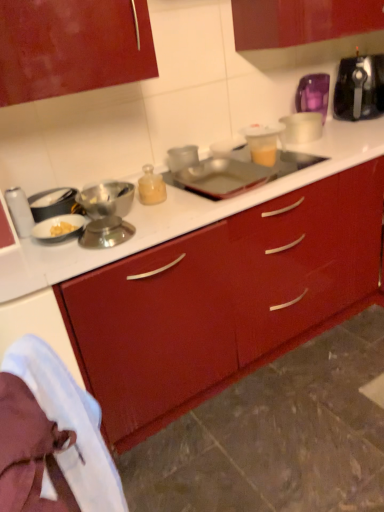
Question: Can you confirm if translucent plastic cup at upper right, the first appliance in the right-to-left sequence, is thinner than metallic silver tray at center, the second appliance from the left?

Choices:
 (A) yes
 (B) no

Answer: (A)

Question: Does translucent plastic cup at upper right, which is counted as the fourth appliance, starting from the left, have a smaller size compared to metallic silver tray at center, which is the 3th appliance from right to left?

Choices:
 (A) yes
 (B) no

Answer: (A)

Question: Is translucent plastic cup at upper right, the first appliance in the right-to-left sequence, closer to the viewer compared to metallic silver tray at center, which is the 3th appliance from right to left?

Choices:
 (A) yes
 (B) no

Answer: (B)

Question: From the image's perspective, is translucent plastic cup at upper right, which is counted as the fourth appliance, starting from the left, on top of metallic silver tray at center, the second appliance from the left?

Choices:
 (A) no
 (B) yes

Answer: (B)

Question: Is translucent plastic cup at upper right, which is counted as the fourth appliance, starting from the left, bigger than metallic silver tray at center, the second appliance from the left?

Choices:
 (A) yes
 (B) no

Answer: (B)

Question: From a real-world perspective, does translucent plastic cup at upper right, the first appliance in the right-to-left sequence, sit lower than metallic silver tray at center, the second appliance from the left?

Choices:
 (A) yes
 (B) no

Answer: (B)

Question: Does white fabric at lower left have a greater width compared to translucent plastic cup at upper center, arranged as the second appliance when viewed from the right?

Choices:
 (A) yes
 (B) no

Answer: (A)

Question: Does white fabric at lower left have a greater height compared to translucent plastic cup at upper center, marked as the 3th appliance in a left-to-right arrangement?

Choices:
 (A) yes
 (B) no

Answer: (A)

Question: From a real-world perspective, is white fabric at lower left located higher than translucent plastic cup at upper center, arranged as the second appliance when viewed from the right?

Choices:
 (A) yes
 (B) no

Answer: (B)

Question: Can you confirm if white fabric at lower left is bigger than translucent plastic cup at upper center, arranged as the second appliance when viewed from the right?

Choices:
 (A) yes
 (B) no

Answer: (A)

Question: Is white fabric at lower left directly adjacent to translucent plastic cup at upper center, marked as the 3th appliance in a left-to-right arrangement?

Choices:
 (A) no
 (B) yes

Answer: (A)

Question: Is white fabric at lower left located outside translucent plastic cup at upper center, arranged as the second appliance when viewed from the right?

Choices:
 (A) yes
 (B) no

Answer: (A)

Question: Considering the relative sizes of translucent plastic cup at upper right, the first appliance in the right-to-left sequence, and black plastic toaster at upper right in the image provided, is translucent plastic cup at upper right, the first appliance in the right-to-left sequence, taller than black plastic toaster at upper right?

Choices:
 (A) no
 (B) yes

Answer: (A)